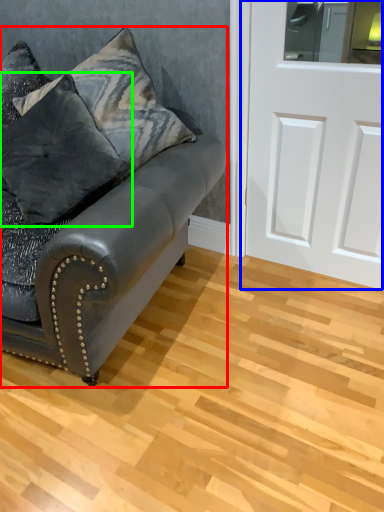
Question: Based on their relative distances, which object is farther from studio couch (highlighted by a red box)? Choose from door (highlighted by a blue box) and pillow (highlighted by a green box).

Choices:
 (A) door
 (B) pillow

Answer: (A)